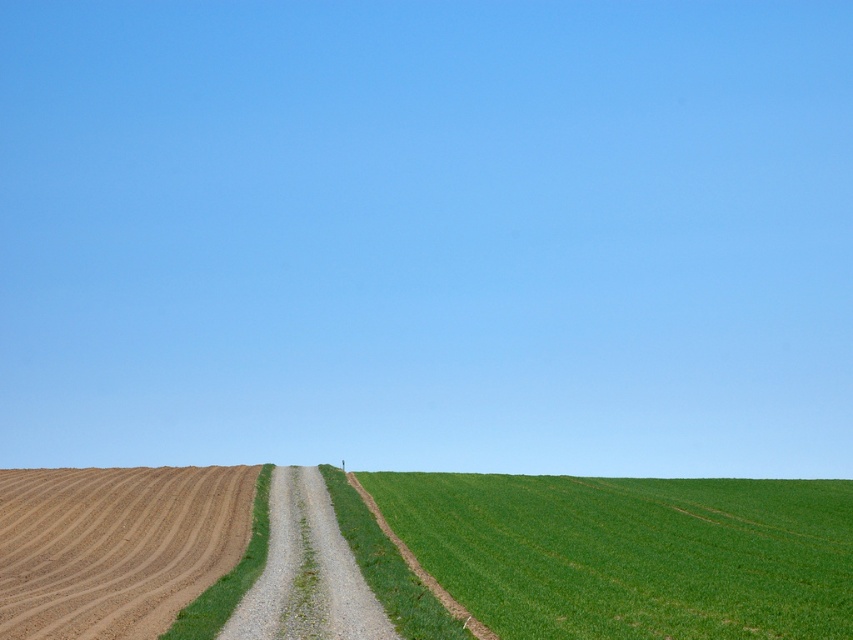
Does brown gravel road at lower left have a lesser height compared to gravelly dirt path at center?

No, brown gravel road at lower left is not shorter than gravelly dirt path at center.

Does brown gravel road at lower left come behind gravelly dirt path at center?

Yes.

Is point (161, 580) closer to viewer compared to point (277, 621)?

That is False.

Locate an element on the screen. brown gravel road at lower left is located at coordinates (115, 545).

Between point (659, 493) and point (94, 532), which one is positioned behind?

Positioned behind is point (659, 493).

Which is above, green grass at lower right or brown gravel road at lower left?

Positioned higher is brown gravel road at lower left.

Between point (613, 486) and point (94, 536), which one is positioned behind?

Point (613, 486)

You are a GUI agent. You are given a task and a screenshot of the screen. Output one action in this format:
    pyautogui.click(x=<x>, y=<y>)
    Task: Click on the green grass at lower right
    
    Given the screenshot: What is the action you would take?
    pyautogui.click(x=631, y=552)

Does point (527, 513) come closer to viewer compared to point (326, 598)?

No.

Where is `green grass at lower right`? This screenshot has width=853, height=640. green grass at lower right is located at coordinates (631, 552).